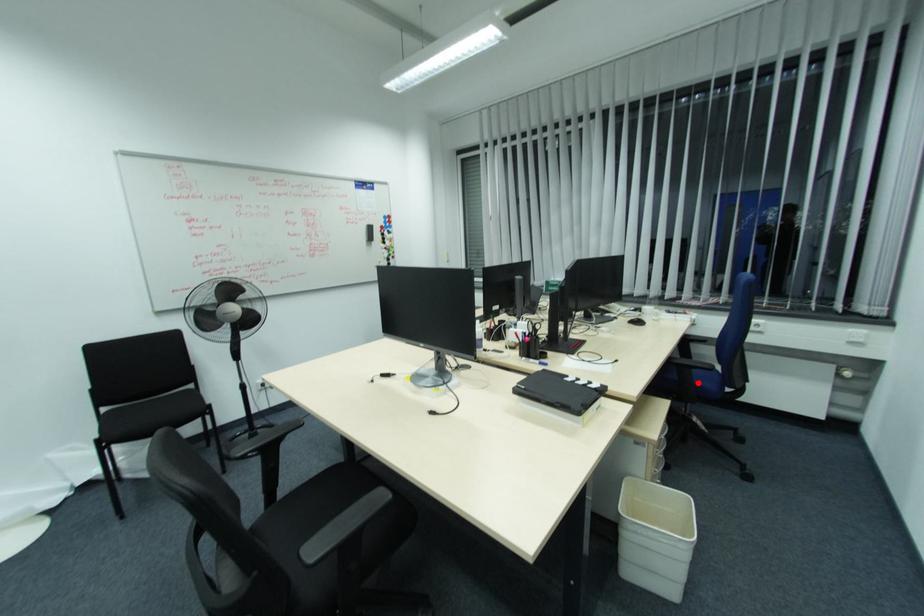
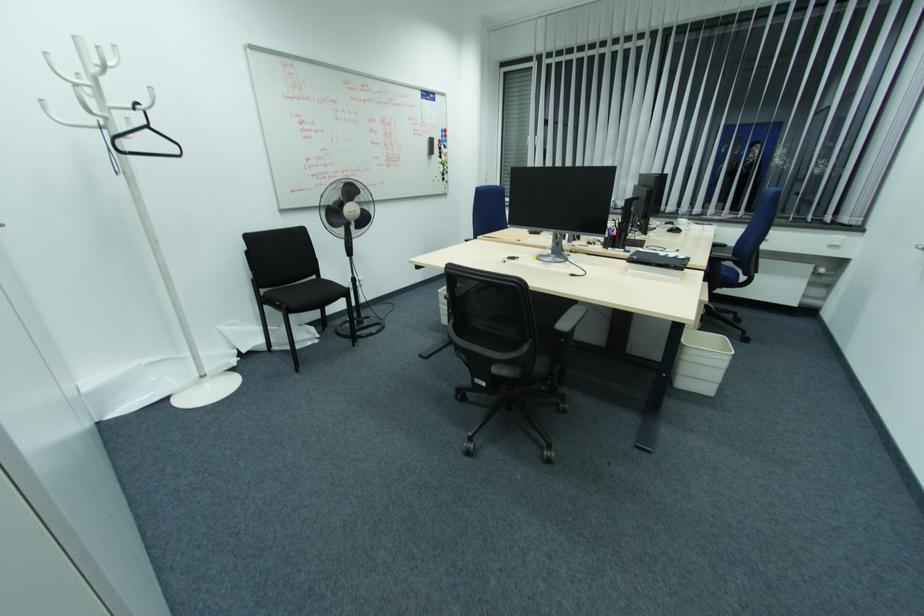
In the second image, find the point that corresponds to the highlighted location in the first image.

(723, 273)